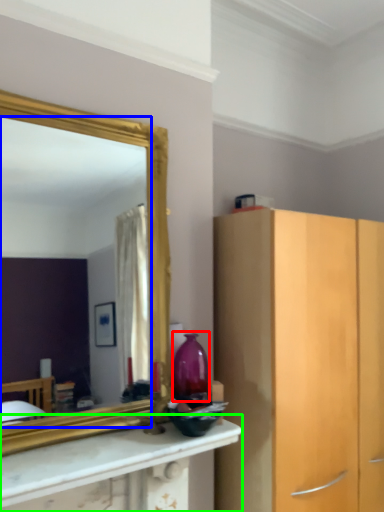
Question: Based on their relative distances, which object is nearer to vase (highlighted by a red box)? Choose from mirror (highlighted by a blue box) and countertop (highlighted by a green box).

Choices:
 (A) mirror
 (B) countertop

Answer: (B)